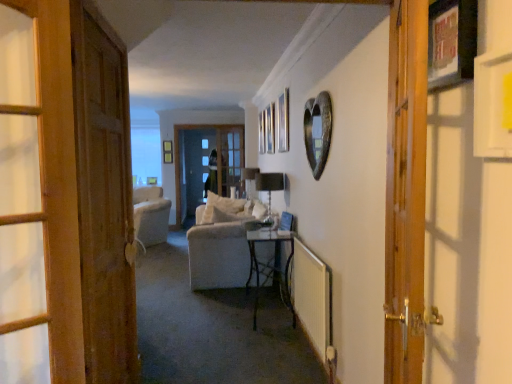
The width and height of the screenshot is (512, 384). In order to click on metallic heart at upper right, arranged as the first picture frame when viewed from the back in this screenshot , I will do `click(317, 131)`.

Consider the image. What is the approximate height of wooden door at right, marked as the 1th door in a front-to-back arrangement?

The height of wooden door at right, marked as the 1th door in a front-to-back arrangement, is 1.50 meters.

I want to click on wooden door at left, which is the 2th door in right-to-left order, so click(105, 206).

Locate an element on the screen. The height and width of the screenshot is (384, 512). wooden picture frame at upper right, which ranks as the second picture frame in back-to-front order is located at coordinates (451, 42).

The image size is (512, 384). In order to click on metallic heart at upper right, which is the 2th picture frame in front-to-back order in this screenshot , I will do `click(317, 131)`.

From the image's perspective, which is below, wooden door at left, placed as the second door when sorted from front to back, or wooden picture frame at upper right, which appears as the first picture frame when viewed from the right?

wooden door at left, placed as the second door when sorted from front to back.

Based on the photo, from a real-world perspective, which object rests below the other?

From a 3D spatial view, wooden door at left, marked as the 1th door in a back-to-front arrangement, is below.

Does wooden door at left, which is the 2th door in right-to-left order, have a lesser height compared to wooden picture frame at upper right, arranged as the 2th picture frame when viewed from the left?

Incorrect, the height of wooden door at left, which is the 2th door in right-to-left order, does not fall short of that of wooden picture frame at upper right, arranged as the 2th picture frame when viewed from the left.

Is wooden picture frame at upper right, arranged as the 2th picture frame when viewed from the left, wider than wooden door at right, acting as the 2th door starting from the left?

In fact, wooden picture frame at upper right, arranged as the 2th picture frame when viewed from the left, might be narrower than wooden door at right, acting as the 2th door starting from the left.

Is wooden picture frame at upper right, which appears as the first picture frame when viewed from the right, closer to the viewer compared to wooden door at right, positioned as the 1th door in right-to-left order?

No, it is behind wooden door at right, positioned as the 1th door in right-to-left order.

From a real-world perspective, between wooden picture frame at upper right, which appears as the first picture frame when viewed from the right, and wooden door at right, positioned as the 1th door in right-to-left order, who is vertically lower?

wooden door at right, positioned as the 1th door in right-to-left order, is physically lower.

Considering the sizes of wooden picture frame at upper right, arranged as the 2th picture frame when viewed from the left, and wooden door at right, acting as the 2th door starting from the left, in the image, is wooden picture frame at upper right, arranged as the 2th picture frame when viewed from the left, taller or shorter than wooden door at right, acting as the 2th door starting from the left,?

wooden picture frame at upper right, arranged as the 2th picture frame when viewed from the left, is shorter than wooden door at right, acting as the 2th door starting from the left.

Considering the points (94, 288) and (319, 133), which point is behind, point (94, 288) or point (319, 133)?

Point (319, 133)

Is wooden door at left, which appears as the first door when viewed from the left, in front of or behind metallic heart at upper right, which is the 2th picture frame in front-to-back order, in the image?

Visually, wooden door at left, which appears as the first door when viewed from the left, is located in front of metallic heart at upper right, which is the 2th picture frame in front-to-back order.

From the image's perspective, which object appears higher, wooden picture frame at upper right, arranged as the 2th picture frame when viewed from the left, or metallic heart at upper right, positioned as the 1th picture frame in left-to-right order?

wooden picture frame at upper right, arranged as the 2th picture frame when viewed from the left, appears higher in the image.

From a real-world perspective, is wooden picture frame at upper right, which appears as the first picture frame when viewed from the right, positioned above or below metallic heart at upper right, which is counted as the 2th picture frame, starting from the right?

From a real-world perspective, wooden picture frame at upper right, which appears as the first picture frame when viewed from the right, is physically above metallic heart at upper right, which is counted as the 2th picture frame, starting from the right.

Is wooden picture frame at upper right, which is counted as the first picture frame, starting from the front, positioned far away from metallic heart at upper right, which is counted as the 2th picture frame, starting from the right?

Yes, wooden picture frame at upper right, which is counted as the first picture frame, starting from the front, and metallic heart at upper right, which is counted as the 2th picture frame, starting from the right, are located far from each other.

Which is more to the right, wooden picture frame at upper right, which ranks as the second picture frame in back-to-front order, or metallic heart at upper right, which is counted as the 2th picture frame, starting from the right?

Positioned to the right is wooden picture frame at upper right, which ranks as the second picture frame in back-to-front order.

From a real-world perspective, does wooden door at right, marked as the 1th door in a front-to-back arrangement, sit lower than metallic heart at upper right, which is counted as the 2th picture frame, starting from the right?

Indeed, from a real-world perspective, wooden door at right, marked as the 1th door in a front-to-back arrangement, is positioned beneath metallic heart at upper right, which is counted as the 2th picture frame, starting from the right.

Is wooden door at right, marked as the 1th door in a front-to-back arrangement, smaller than metallic heart at upper right, positioned as the 1th picture frame in left-to-right order?

Actually, wooden door at right, marked as the 1th door in a front-to-back arrangement, might be larger than metallic heart at upper right, positioned as the 1th picture frame in left-to-right order.

Between wooden door at right, acting as the 2th door starting from the left, and metallic heart at upper right, which is the 2th picture frame in front-to-back order, which one appears on the left side from the viewer's perspective?

metallic heart at upper right, which is the 2th picture frame in front-to-back order, is more to the left.

Can you see wooden door at right, marked as the 1th door in a front-to-back arrangement, touching metallic heart at upper right, which is the 2th picture frame in front-to-back order?

They are not placed beside each other.

Considering the positions of objects metallic heart at upper right, arranged as the first picture frame when viewed from the back, and wooden picture frame at upper right, arranged as the 2th picture frame when viewed from the left, in the image provided, who is more to the left, metallic heart at upper right, arranged as the first picture frame when viewed from the back, or wooden picture frame at upper right, arranged as the 2th picture frame when viewed from the left,?

Positioned to the left is metallic heart at upper right, arranged as the first picture frame when viewed from the back.

Can you confirm if metallic heart at upper right, arranged as the first picture frame when viewed from the back, is taller than wooden picture frame at upper right, arranged as the 2th picture frame when viewed from the left?

Yes.

Which is in front, metallic heart at upper right, arranged as the first picture frame when viewed from the back, or wooden picture frame at upper right, which is counted as the first picture frame, starting from the front?

wooden picture frame at upper right, which is counted as the first picture frame, starting from the front, is in front.

From the image's perspective, does wooden door at right, acting as the 2th door starting from the left, appear lower than wooden door at left, which is the 2th door in right-to-left order?

No, from the image's perspective, wooden door at right, acting as the 2th door starting from the left, is not below wooden door at left, which is the 2th door in right-to-left order.

Locate an element on the screen. door that appears behind the wooden door at right, acting as the 2th door starting from the left is located at coordinates (105, 206).

Considering the sizes of wooden door at right, acting as the 2th door starting from the left, and wooden door at left, which is the 2th door in right-to-left order, in the image, is wooden door at right, acting as the 2th door starting from the left, bigger or smaller than wooden door at left, which is the 2th door in right-to-left order,?

In the image, wooden door at right, acting as the 2th door starting from the left, appears to be smaller than wooden door at left, which is the 2th door in right-to-left order.

From the picture: Which point is more distant from viewer, (407,201) or (131,276)?

The point (131,276) is farther.

From a real-world perspective, starting from the wooden picture frame at upper right, which ranks as the second picture frame in back-to-front order, which door is the 2nd one below it? Please provide its 2D coordinates.

[(105, 206)]

Identify the location of the 2nd picture frame located above the wooden door at right, the 2th door viewed from the back (from a real-world perspective). The height and width of the screenshot is (384, 512). pyautogui.click(x=451, y=42).

When comparing their distances from metallic heart at upper right, positioned as the 1th picture frame in left-to-right order, does wooden door at left, which appears as the first door when viewed from the left, or wooden door at right, positioned as the 1th door in right-to-left order, seem closer?

Based on the image, wooden door at right, positioned as the 1th door in right-to-left order, appears to be nearer to metallic heart at upper right, positioned as the 1th picture frame in left-to-right order.

Based on the photo, estimate the real-world distances between objects in this image. Which object is closer to wooden picture frame at upper right, which is counted as the first picture frame, starting from the front, metallic heart at upper right, arranged as the first picture frame when viewed from the back, or wooden door at left, marked as the 1th door in a back-to-front arrangement?

Among the two, metallic heart at upper right, arranged as the first picture frame when viewed from the back, is located nearer to wooden picture frame at upper right, which is counted as the first picture frame, starting from the front.

From the image, which object appears to be farther from wooden picture frame at upper right, arranged as the 2th picture frame when viewed from the left, wooden door at left, which appears as the first door when viewed from the left, or wooden door at right, positioned as the 1th door in right-to-left order?

wooden door at left, which appears as the first door when viewed from the left, is positioned further to the anchor wooden picture frame at upper right, arranged as the 2th picture frame when viewed from the left.

Considering their positions, is wooden door at right, acting as the 2th door starting from the left, positioned further to metallic heart at upper right, arranged as the first picture frame when viewed from the back, than wooden picture frame at upper right, arranged as the 2th picture frame when viewed from the left?

Among the two, wooden picture frame at upper right, arranged as the 2th picture frame when viewed from the left, is located further to metallic heart at upper right, arranged as the first picture frame when viewed from the back.

From the image, which object appears to be nearer to wooden door at left, placed as the second door when sorted from front to back, wooden door at right, the 2th door viewed from the back, or wooden picture frame at upper right, which appears as the first picture frame when viewed from the right?

wooden door at right, the 2th door viewed from the back, lies closer to wooden door at left, placed as the second door when sorted from front to back, than the other object.

Based on their spatial positions, is wooden door at right, marked as the 1th door in a front-to-back arrangement, or metallic heart at upper right, which is counted as the 2th picture frame, starting from the right, further from wooden door at left, placed as the second door when sorted from front to back?

Based on the image, metallic heart at upper right, which is counted as the 2th picture frame, starting from the right, appears to be further to wooden door at left, placed as the second door when sorted from front to back.

Looking at the image, which one is located further to wooden door at right, the 2th door viewed from the back, wooden door at left, which is the 2th door in right-to-left order, or metallic heart at upper right, which is the 2th picture frame in front-to-back order?

The object further to wooden door at right, the 2th door viewed from the back, is metallic heart at upper right, which is the 2th picture frame in front-to-back order.

Which object lies further to the anchor point metallic heart at upper right, arranged as the first picture frame when viewed from the back, wooden door at right, the 2th door viewed from the back, or wooden door at left, which appears as the first door when viewed from the left?

→ wooden door at left, which appears as the first door when viewed from the left, is further to metallic heart at upper right, arranged as the first picture frame when viewed from the back.

Locate an element on the screen. The image size is (512, 384). picture frame positioned between wooden door at right, the 2th door viewed from the back, and metallic heart at upper right, arranged as the first picture frame when viewed from the back, from near to far is located at coordinates (451, 42).

This screenshot has height=384, width=512. I want to click on door positioned between wooden door at right, positioned as the 1th door in right-to-left order, and metallic heart at upper right, positioned as the 1th picture frame in left-to-right order, from near to far, so click(x=105, y=206).

At what (x,y) coordinates should I click in order to perform the action: click on door between wooden door at left, which is the 2th door in right-to-left order, and wooden picture frame at upper right, arranged as the 2th picture frame when viewed from the left. Please return your answer as a coordinate pair (x, y). The height and width of the screenshot is (384, 512). Looking at the image, I should click on click(406, 192).

The width and height of the screenshot is (512, 384). In order to click on door positioned between wooden picture frame at upper right, which is counted as the first picture frame, starting from the front, and metallic heart at upper right, which is the 2th picture frame in front-to-back order, from near to far in this screenshot , I will do `click(105, 206)`.